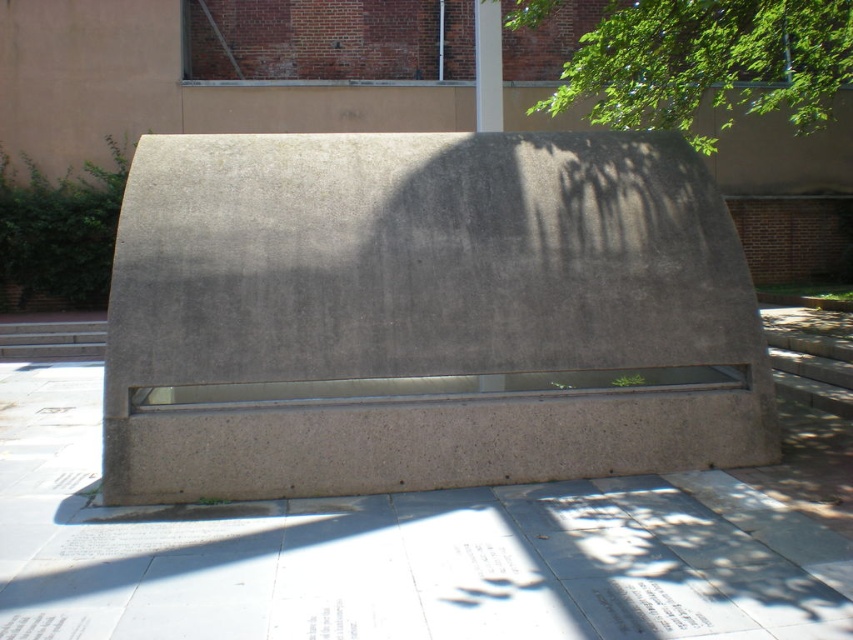
Question: Is gray concrete bench at center bigger than green leafy tree at upper right?

Choices:
 (A) yes
 (B) no

Answer: (B)

Question: Can you confirm if gray concrete bench at center is positioned to the right of green leafy tree at upper right?

Choices:
 (A) yes
 (B) no

Answer: (B)

Question: Which of the following is the farthest from the observer?

Choices:
 (A) gray concrete bench at center
 (B) green leafy tree at upper right

Answer: (B)

Question: Which point is farther to the camera?

Choices:
 (A) (270, 481)
 (B) (718, 22)

Answer: (B)

Question: Which point appears farthest from the camera in this image?

Choices:
 (A) (740, 92)
 (B) (428, 243)

Answer: (A)

Question: Can you confirm if gray concrete bench at center is positioned to the left of green leafy tree at upper right?

Choices:
 (A) yes
 (B) no

Answer: (A)